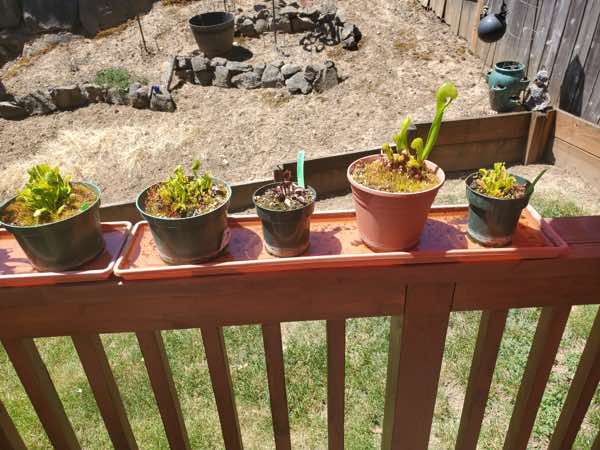
This screenshot has width=600, height=450. Find the location of `tray`. tray is located at coordinates (146, 262), (12, 264).